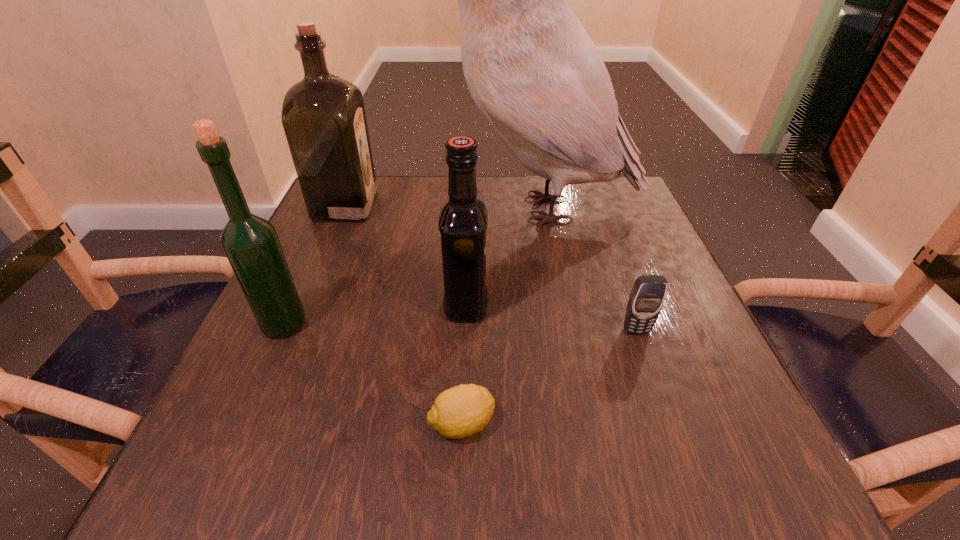
Locate an element on the screen. The width and height of the screenshot is (960, 540). free space between the cellular telephone and the parakeet is located at coordinates (588, 270).

This screenshot has height=540, width=960. What are the coordinates of `unoccupied area between the tallest object and the lemon` in the screenshot? It's located at (501, 316).

Image resolution: width=960 pixels, height=540 pixels. Find the location of `vacant point located between the rightmost liquor and the farthest liquor`. vacant point located between the rightmost liquor and the farthest liquor is located at coordinates (406, 255).

You are a GUI agent. You are given a task and a screenshot of the screen. Output one action in this format:
    pyautogui.click(x=<x>, y=<y>)
    Task: Click on the blank region between the lemon and the rightmost liquor
    
    Given the screenshot: What is the action you would take?
    pyautogui.click(x=464, y=364)

Locate an element on the screen. The width and height of the screenshot is (960, 540). free area in between the shortest object and the fifth tallest object is located at coordinates (549, 377).

The width and height of the screenshot is (960, 540). In order to click on object that stands as the second closest to the tallest object in this screenshot , I will do `click(463, 219)`.

Find the location of a particular element. The image size is (960, 540). object that can be found as the third closest to the nearest object is located at coordinates (250, 242).

Where is `the closest liquor to the cellular telephone`? The width and height of the screenshot is (960, 540). the closest liquor to the cellular telephone is located at coordinates (463, 219).

Locate an element on the screen. The image size is (960, 540). the second closest liquor relative to the rightmost liquor is located at coordinates (323, 116).